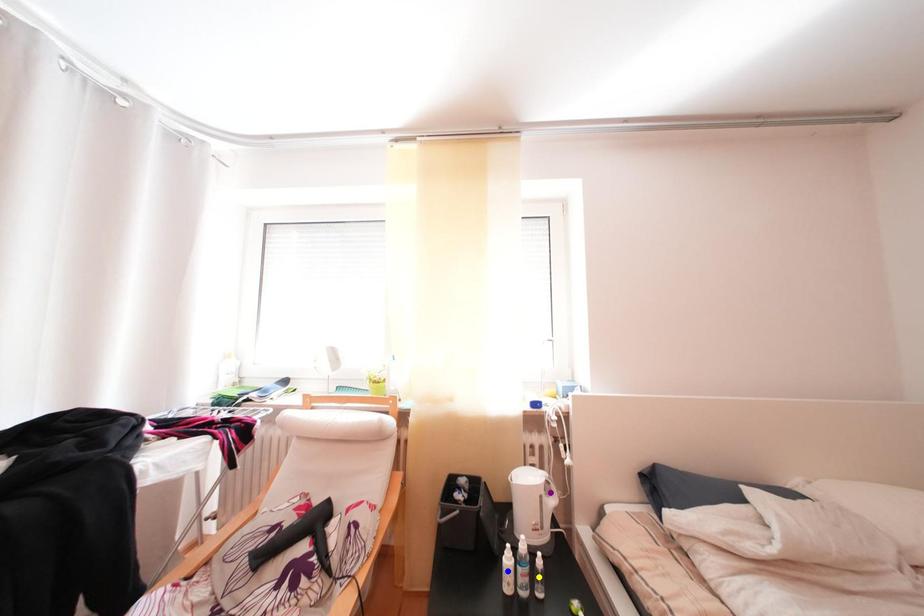
Order these from farthest to nearest:
yellow point | blue point | purple point

purple point
blue point
yellow point